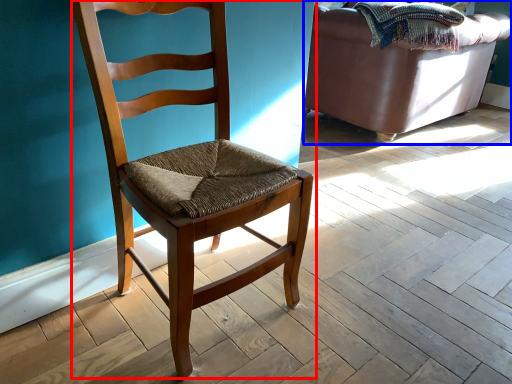
Question: Which of the following is the farthest to the observer, chair (highlighted by a red box) or studio couch (highlighted by a blue box)?

Choices:
 (A) chair
 (B) studio couch

Answer: (B)